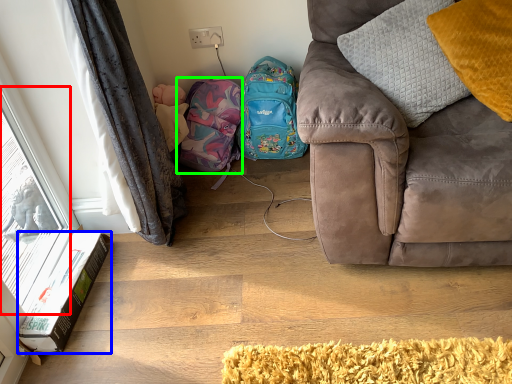
Question: Considering the real-world distances, which object is closest to window (highlighted by a red box)? box (highlighted by a blue box) or bag (highlighted by a green box).

Choices:
 (A) box
 (B) bag

Answer: (A)